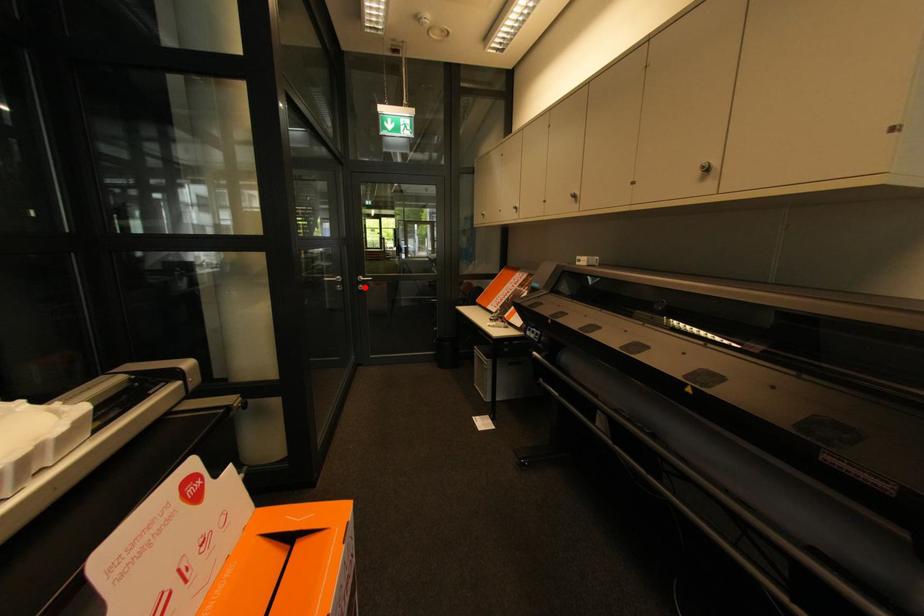
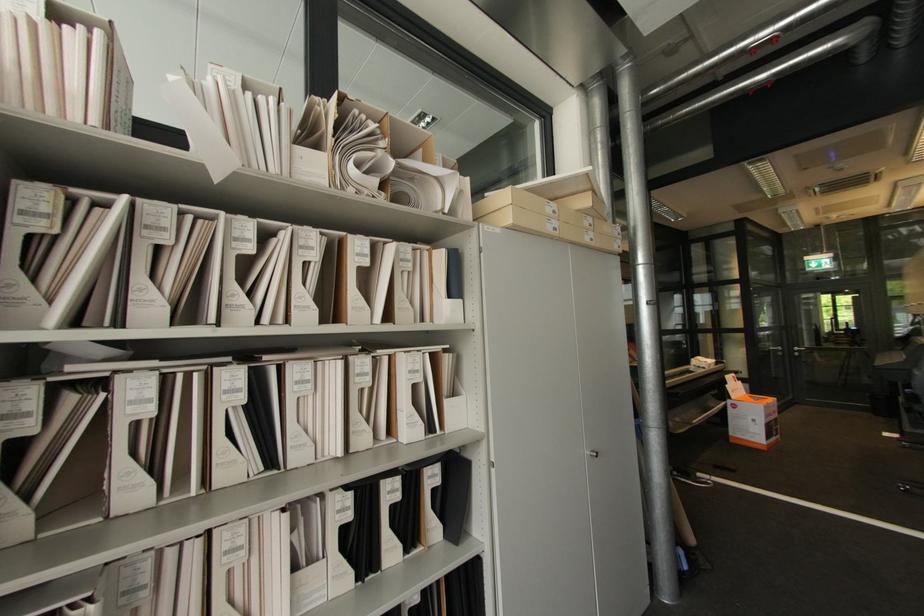
Question: A red point is marked in image1. In image2, is the corresponding 3D point closer to the camera or farther? Reply with the corresponding letter.

Choices:
 (A) The corresponding 3D point is closer.
 (B) The corresponding 3D point is farther.

Answer: (A)